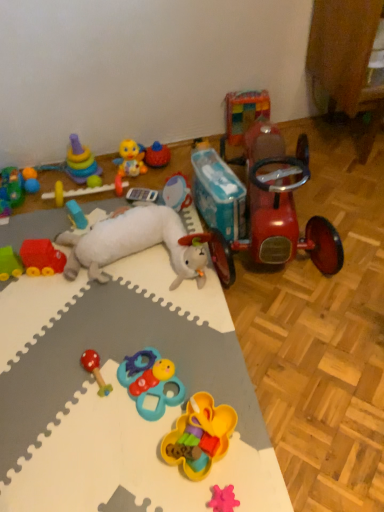
You are a GUI agent. You are given a task and a screenshot of the screen. Output one action in this format:
    pyautogui.click(x=<x>, y=<y>)
    Task: Click on the vacant area that is in front of rubberized plastic toy at center, the tenth toy positioned from the right
    The width and height of the screenshot is (384, 512).
    Given the screenshot: What is the action you would take?
    pyautogui.click(x=87, y=215)